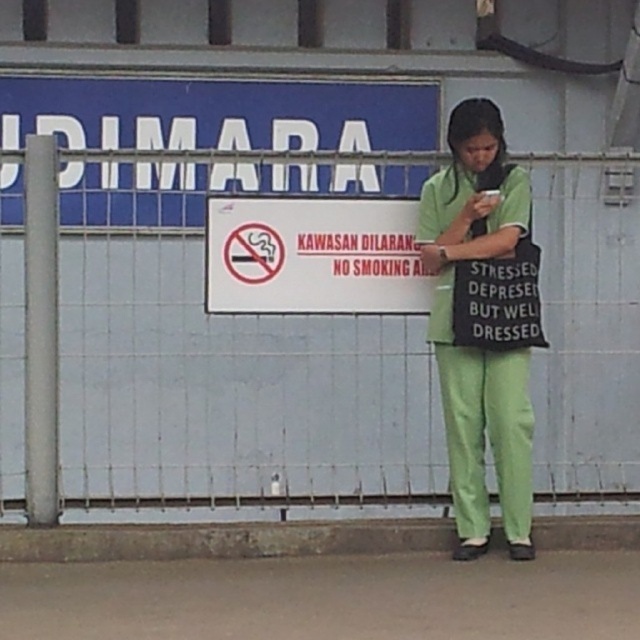
You are a delivery person trying to pass through the metal wire fence at center while carrying the green fabric bag at center. Can you fit through the fence without squeezing the bag?

The metal wire fence at center is wider than the green fabric bag at center, so you can fit through the fence without squeezing the bag.

You are a delivery robot with a height of 1.5 meters. You need to pass through the space between the metal wire fence at center and the white paper sign at center. Can you fit through the space without bending down?

The distance between the metal wire fence at center and the white paper sign at center is 1.39 meters. Since the robot is 1.5 meters tall, it is taller than the available space. Therefore, the robot cannot pass through without bending down.

You are a delivery person trying to pass through the area. The metal wire fence at center and the green fabric bag at center are in your path. Which object is larger and might block your way more?

The metal wire fence at center is bigger than the green fabric bag at center, so it might block your way more.